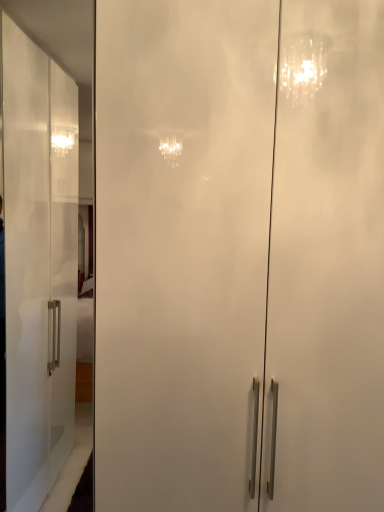
Identify the location of frosted glass cabinet at center. (38, 265).

Measure the distance between frosted glass cabinet at center and camera.

frosted glass cabinet at center and camera are 5.56 feet apart from each other.

What do you see at coordinates (38, 265) in the screenshot? I see `frosted glass cabinet at center` at bounding box center [38, 265].

The image size is (384, 512). Identify the location of frosted glass cabinet at center. pos(38,265).